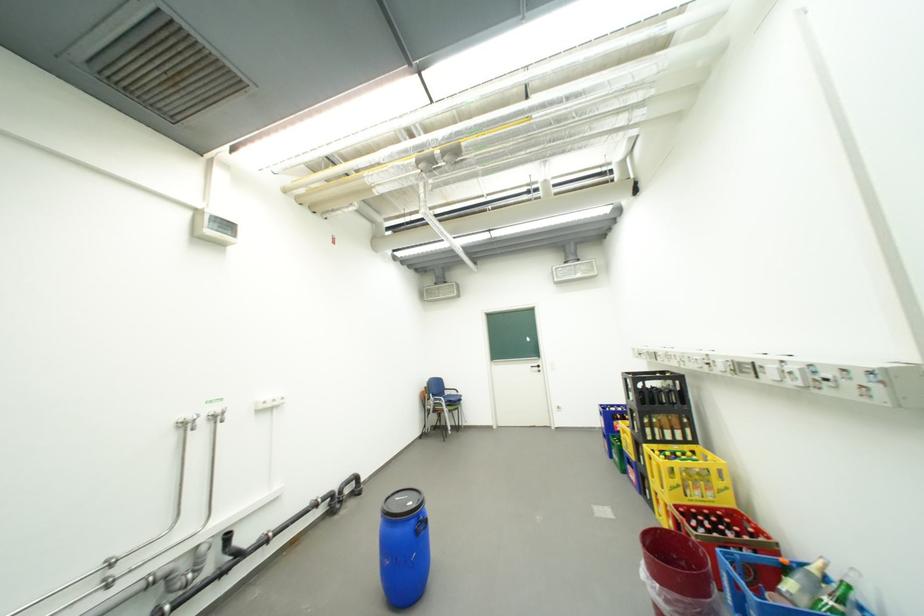
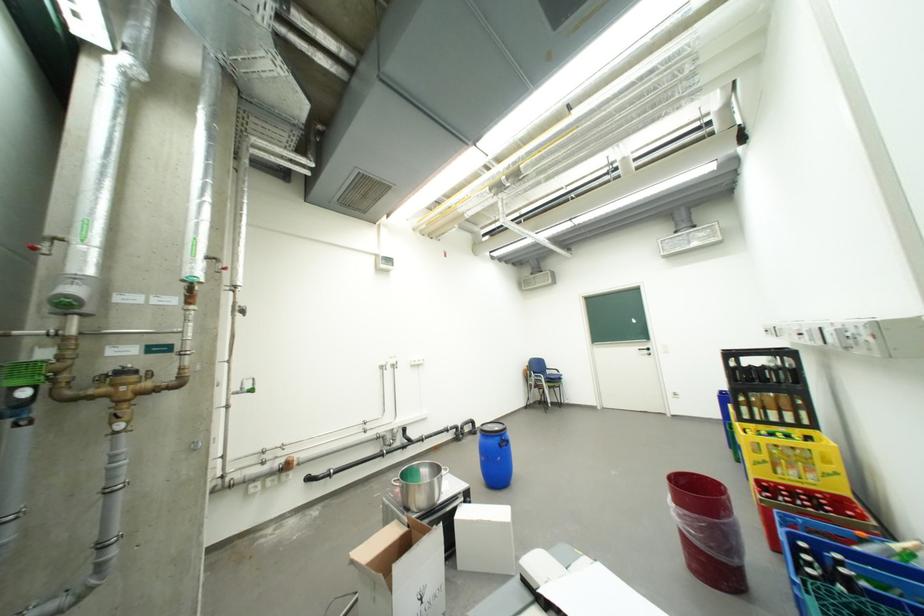
Find the pixel in the second image that matches point 669,586 in the first image.

(685, 507)